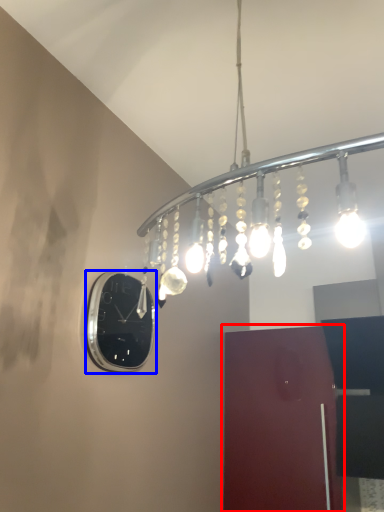
Question: Among these objects, which one is farthest to the camera, door (highlighted by a red box) or clock (highlighted by a blue box)?

Choices:
 (A) door
 (B) clock

Answer: (A)